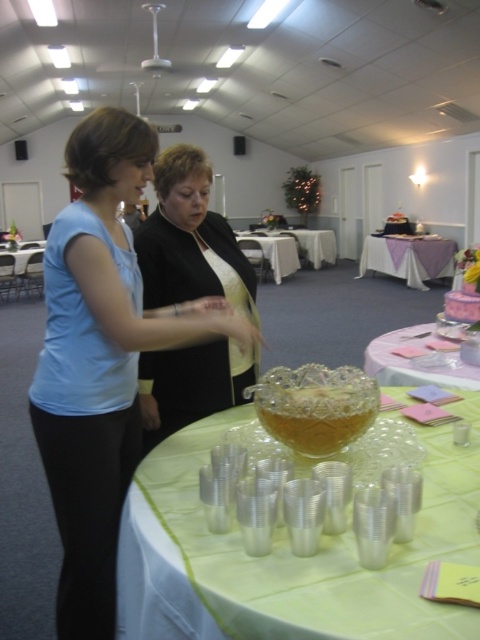
You are standing in the banquet hall and need to locate the matte blue shirt at left. According to the coordinates provided, where exactly would you find it in the image?

The matte blue shirt at left is located at the 2D coordinates point (101, 358) in the image.